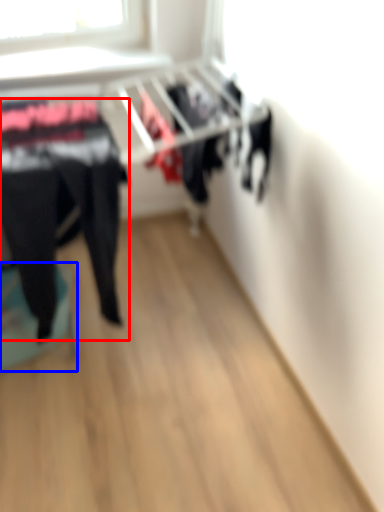
Question: Which point is further to the camera, clothing (highlighted by a red box) or furniture (highlighted by a blue box)?

Choices:
 (A) clothing
 (B) furniture

Answer: (B)